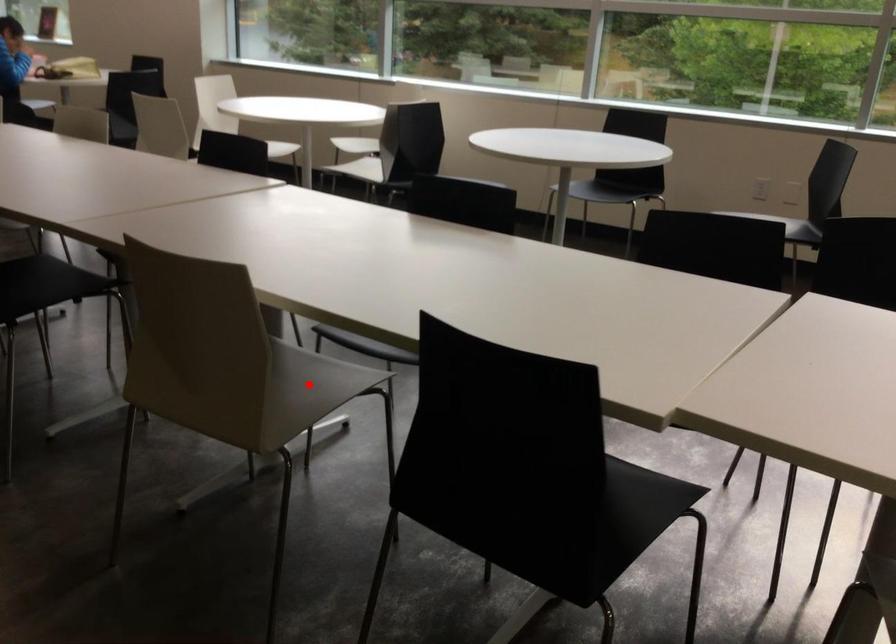
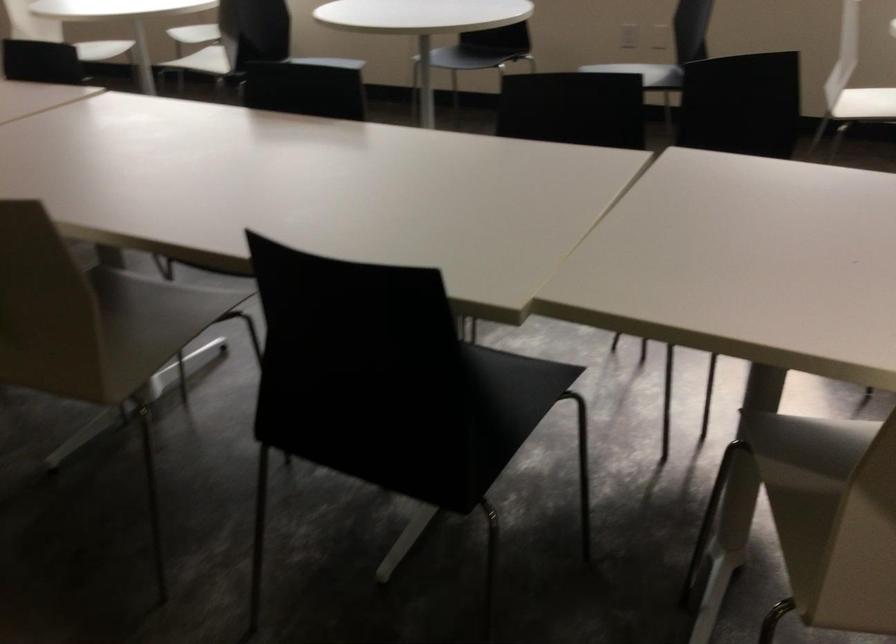
Question: I am providing you with two images of the same scene from different viewpoints. A red point is marked on the first image. Can you still see the location of the red point in image 2?

Choices:
 (A) Yes
 (B) No

Answer: (A)